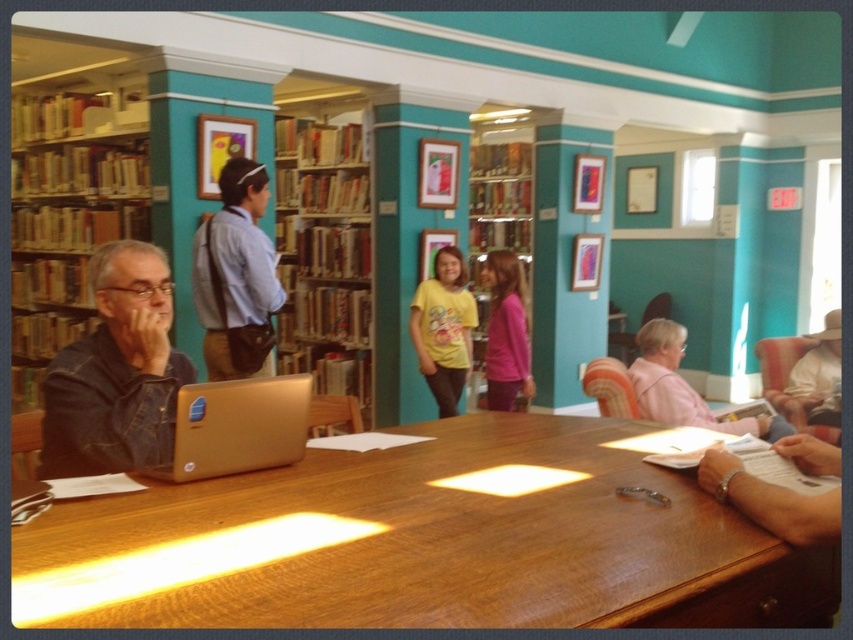
Question: Observing the image, what is the correct spatial positioning of brown wooden bookcase at left in reference to light blue shirt at center?

Choices:
 (A) above
 (B) below

Answer: (A)

Question: Which object is the closest to the wooden bookcase at center?

Choices:
 (A) light blue shirt at center
 (B) pink matte shirt at center

Answer: (B)

Question: Is gold metallic laptop at center thinner than yellow matte shirt at center?

Choices:
 (A) no
 (B) yes

Answer: (B)

Question: Is brown wooden bookcase at left to the left of yellow matte shirt at center from the viewer's perspective?

Choices:
 (A) no
 (B) yes

Answer: (B)

Question: Which point is closer to the camera?

Choices:
 (A) (61, 284)
 (B) (289, 269)
 (C) (460, 333)

Answer: (C)

Question: Which of the following is the closest to the observer?

Choices:
 (A) gold metallic laptop at center
 (B) wooden bookcase at center
 (C) denim jacket at left
 (D) brown wooden bookcase at left

Answer: (A)